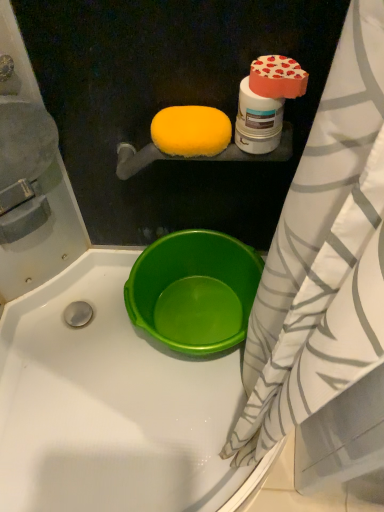
Question: Is yellow sponge at upper center, arranged as the first food when viewed from the left, wider than white striped fabric at right?

Choices:
 (A) no
 (B) yes

Answer: (A)

Question: Can you see yellow sponge at upper center, arranged as the first food when viewed from the left, touching white striped fabric at right?

Choices:
 (A) no
 (B) yes

Answer: (A)

Question: From a real-world perspective, is yellow sponge at upper center, positioned as the 1th food in back-to-front order, beneath white striped fabric at right?

Choices:
 (A) no
 (B) yes

Answer: (A)

Question: Does yellow sponge at upper center, positioned as the 1th food in back-to-front order, have a larger size compared to white striped fabric at right?

Choices:
 (A) no
 (B) yes

Answer: (A)

Question: Is yellow sponge at upper center, arranged as the 2th food when viewed from the right, oriented towards white striped fabric at right?

Choices:
 (A) yes
 (B) no

Answer: (B)

Question: From the image's perspective, relative to smooth matte heart-shaped box at upper right, marked as the 1th food in a front-to-back arrangement, is yellow sponge at upper center, arranged as the 2th food when viewed from the right, above or below?

Choices:
 (A) above
 (B) below

Answer: (B)

Question: Does point (216, 141) appear closer or farther from the camera than point (297, 71)?

Choices:
 (A) closer
 (B) farther

Answer: (B)

Question: Considering the positions of yellow sponge at upper center, arranged as the first food when viewed from the left, and smooth matte heart-shaped box at upper right, which ranks as the 2th food in back-to-front order, in the image, is yellow sponge at upper center, arranged as the first food when viewed from the left, wider or thinner than smooth matte heart-shaped box at upper right, which ranks as the 2th food in back-to-front order,?

Choices:
 (A) wide
 (B) thin

Answer: (A)

Question: Is yellow sponge at upper center, positioned as the 1th food in back-to-front order, inside or outside of smooth matte heart-shaped box at upper right, which is counted as the 1th food, starting from the right?

Choices:
 (A) inside
 (B) outside

Answer: (B)

Question: Relative to white striped fabric at right, is smooth matte heart-shaped box at upper right, which ranks as the 2th food in back-to-front order, in front or behind?

Choices:
 (A) front
 (B) behind

Answer: (B)

Question: Is point (291, 76) closer or farther from the camera than point (364, 180)?

Choices:
 (A) farther
 (B) closer

Answer: (A)

Question: Considering the positions of smooth matte heart-shaped box at upper right, which ranks as the 2th food in back-to-front order, and white striped fabric at right in the image, is smooth matte heart-shaped box at upper right, which ranks as the 2th food in back-to-front order, wider or thinner than white striped fabric at right?

Choices:
 (A) thin
 (B) wide

Answer: (A)

Question: In terms of size, does smooth matte heart-shaped box at upper right, the 2th food from the left, appear bigger or smaller than white striped fabric at right?

Choices:
 (A) small
 (B) big

Answer: (A)

Question: Do you think yellow sponge at upper center, arranged as the 2th food when viewed from the right, is within white striped fabric at right, or outside of it?

Choices:
 (A) outside
 (B) inside

Answer: (A)

Question: Considering the positions of yellow sponge at upper center, arranged as the 2th food when viewed from the right, and white striped fabric at right in the image, is yellow sponge at upper center, arranged as the 2th food when viewed from the right, wider or thinner than white striped fabric at right?

Choices:
 (A) thin
 (B) wide

Answer: (A)